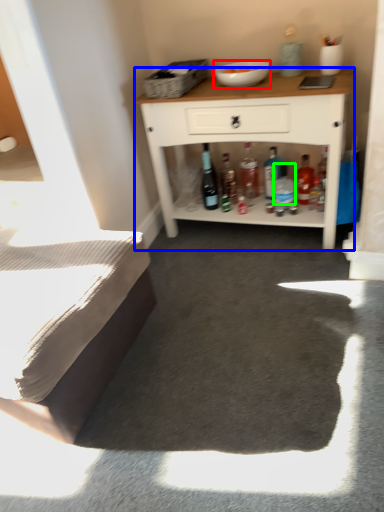
Question: Which object is the closest to the bowl (highlighted by a red box)? Choose among these: cabinetry (highlighted by a blue box) or bottle (highlighted by a green box).

Choices:
 (A) cabinetry
 (B) bottle

Answer: (A)